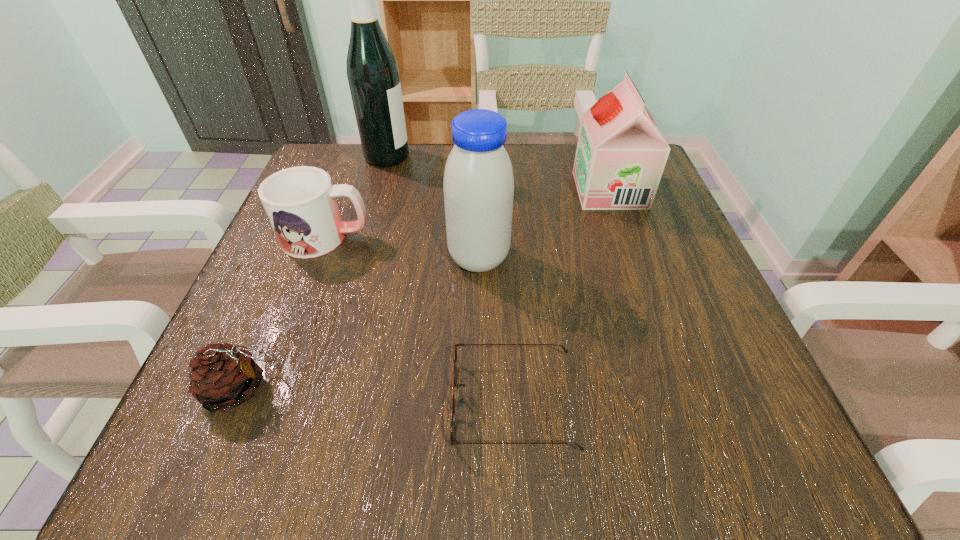
You are a GUI agent. You are given a task and a screenshot of the screen. Output one action in this format:
    pyautogui.click(x=<x>, y=<y>)
    Task: Click on the vacant space located 0.260m on the back of the taller soya milk
    The image size is (960, 540).
    Given the screenshot: What is the action you would take?
    pyautogui.click(x=479, y=165)

Where is `vacant space located 0.230m with the cap open on the second farthest object`? The height and width of the screenshot is (540, 960). vacant space located 0.230m with the cap open on the second farthest object is located at coordinates (471, 190).

This screenshot has height=540, width=960. Identify the location of free space located 0.370m with the cap open on the second farthest object. (407, 190).

The height and width of the screenshot is (540, 960). What are the coordinates of `vacant space located with the cap open on the second farthest object` in the screenshot? It's located at (536, 190).

The height and width of the screenshot is (540, 960). Identify the location of free location located 0.100m on the side of the third shortest object with the handle. (422, 237).

Locate an element on the screen. This screenshot has height=540, width=960. free space located 0.160m with a leaf charm attached to the fifth tallest object is located at coordinates (393, 389).

At what (x,y) coordinates should I click in order to perform the action: click on vacant space situated on the front-facing side of the sunglasses. Please return your answer as a coordinate pair (x, y). Looking at the image, I should click on (309, 403).

The width and height of the screenshot is (960, 540). I want to click on free region located on the front-facing side of the sunglasses, so click(x=229, y=403).

What are the coordinates of `free space located 0.280m on the front-facing side of the sunglasses` in the screenshot? It's located at (252, 403).

I want to click on wine bottle that is at the far edge, so click(372, 70).